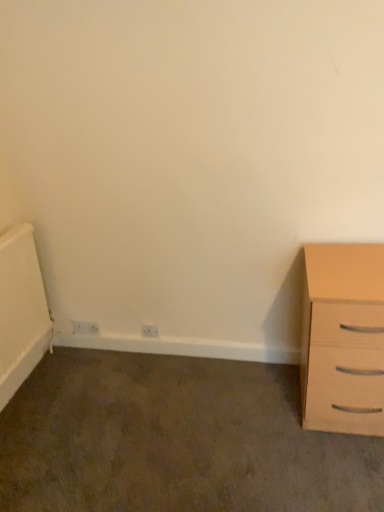
Locate an element on the screen. free space in front of light wood chest of drawers at right is located at coordinates (333, 473).